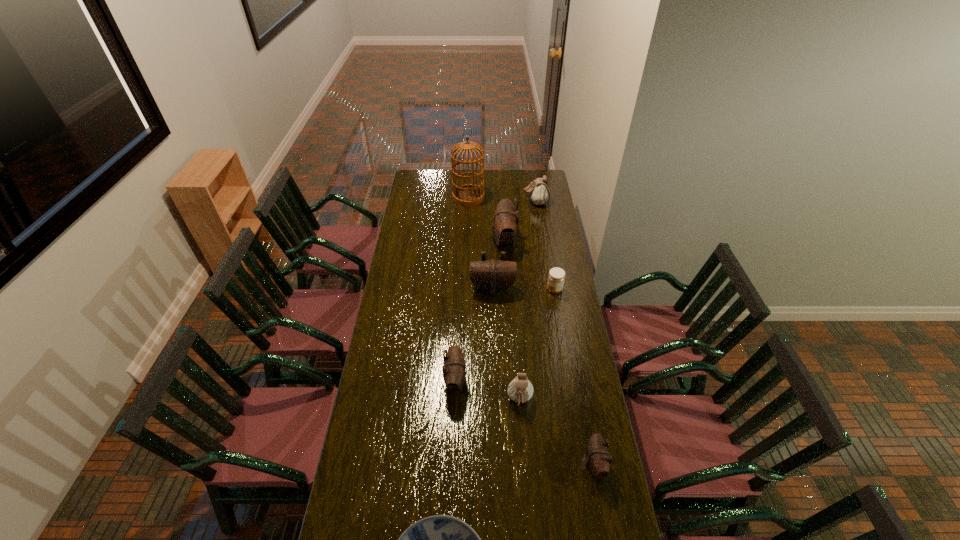
At what (x,y) coordinates should I click in order to perform the action: click on birdcage. Please return your answer as a coordinate pair (x, y). The image size is (960, 540). Looking at the image, I should click on (468, 195).

Image resolution: width=960 pixels, height=540 pixels. I want to click on the biggest brown pouch, so click(505, 224).

Locate an element on the screen. Image resolution: width=960 pixels, height=540 pixels. the tallest pouch is located at coordinates (505, 224).

Identify the location of the third nearest brown pouch. (492, 276).

Find the location of `the second biggest brown pouch`. the second biggest brown pouch is located at coordinates (492, 276).

You are a GUI agent. You are given a task and a screenshot of the screen. Output one action in this format:
    pyautogui.click(x=<x>, y=<y>)
    Task: Click on the farther white pouch
    The image size is (960, 540).
    Given the screenshot: What is the action you would take?
    pyautogui.click(x=539, y=191)

Find the location of `the farthest pouch`. the farthest pouch is located at coordinates (539, 191).

The image size is (960, 540). Identify the location of the third farthest brown pouch. (454, 369).

This screenshot has width=960, height=540. Find the location of `the leftmost pouch`. the leftmost pouch is located at coordinates (454, 369).

Locate an element on the screen. The width and height of the screenshot is (960, 540). the left white pouch is located at coordinates (520, 389).